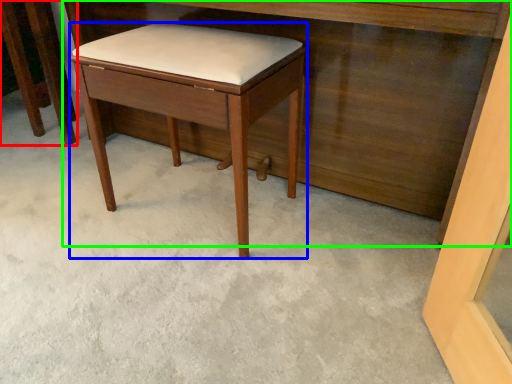
Question: Which object is the closest to the furniture (highlighted by a red box)? Choose among these: stool (highlighted by a blue box) or vanity (highlighted by a green box).

Choices:
 (A) stool
 (B) vanity

Answer: (B)